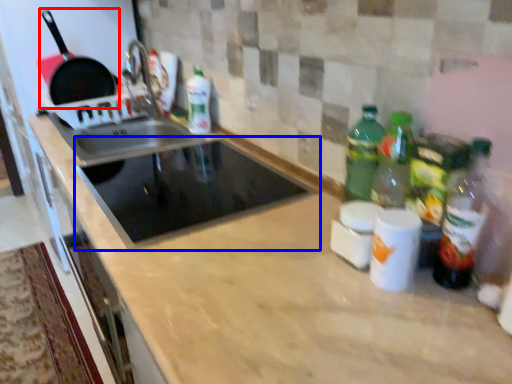
Question: Which point is closer to the camera, frying pan (highlighted by a red box) or appliance (highlighted by a blue box)?

Choices:
 (A) frying pan
 (B) appliance

Answer: (B)